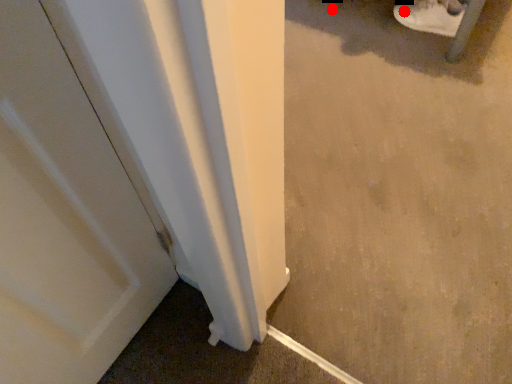
Question: Two points are circled on the image, labeled by A and B beside each circle. Which point is farther from the camera taking this photo?

Choices:
 (A) A is further
 (B) B is further

Answer: (B)